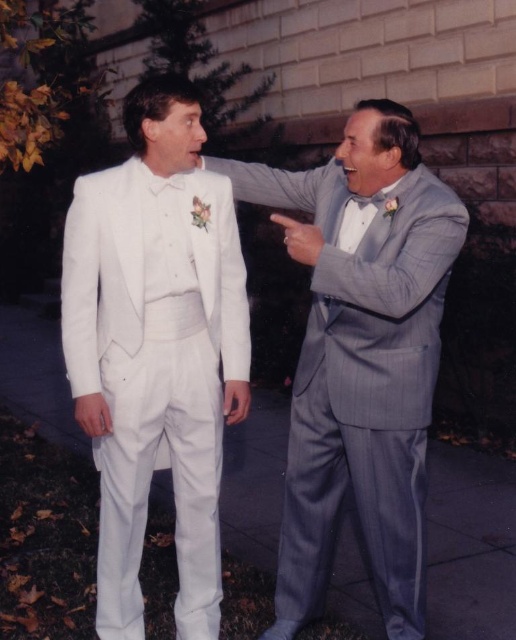
Who is higher up, white satin tuxedo at center or gray satin bow tie at upper right?

gray satin bow tie at upper right is higher up.

Can you confirm if white satin tuxedo at center is positioned to the left of gray satin bow tie at upper right?

Yes, white satin tuxedo at center is to the left of gray satin bow tie at upper right.

What do you see at coordinates (155, 349) in the screenshot?
I see `white satin tuxedo at center` at bounding box center [155, 349].

Identify the location of white satin tuxedo at center. The image size is (516, 640). (155, 349).

Who is taller, white satin tuxedo at center or gray pinstripe suit at right?

With more height is white satin tuxedo at center.

Which of these two, white satin tuxedo at center or gray pinstripe suit at right, stands shorter?

gray pinstripe suit at right

Describe the element at coordinates (155, 349) in the screenshot. I see `white satin tuxedo at center` at that location.

The image size is (516, 640). Identify the location of white satin tuxedo at center. (155, 349).

Can you confirm if gray pinstripe suit at right is taller than gray satin bow tie at upper right?

Yes, gray pinstripe suit at right is taller than gray satin bow tie at upper right.

Does gray pinstripe suit at right appear under gray satin bow tie at upper right?

Correct, gray pinstripe suit at right is located below gray satin bow tie at upper right.

Between point (378, 525) and point (378, 193), which one is positioned behind?

Point (378, 525)

Locate an element on the screen. The image size is (516, 640). gray pinstripe suit at right is located at coordinates (361, 358).